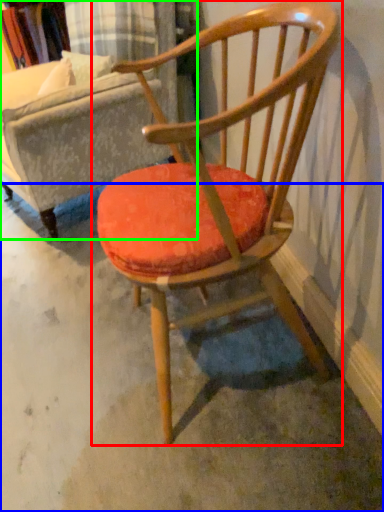
Question: Which is nearer to the chair (highlighted by a red box)? concrete (highlighted by a blue box) or swivel chair (highlighted by a green box).

Choices:
 (A) concrete
 (B) swivel chair

Answer: (A)